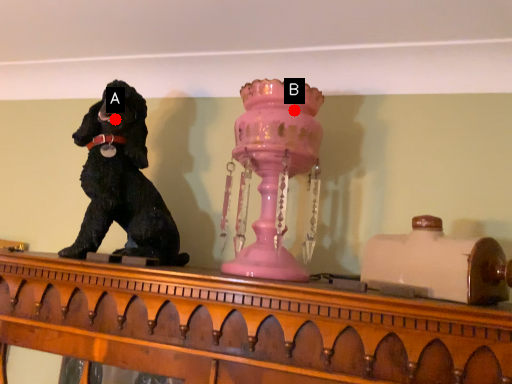
Question: Two points are circled on the image, labeled by A and B beside each circle. Among these points, which one is nearest to the camera?

Choices:
 (A) A is closer
 (B) B is closer

Answer: (B)